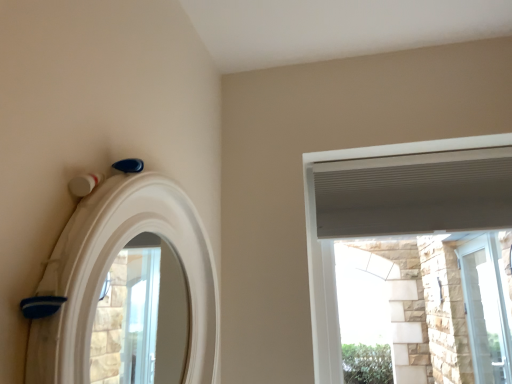
The image size is (512, 384). What do you see at coordinates (109, 268) in the screenshot?
I see `white matte archway at upper left` at bounding box center [109, 268].

The width and height of the screenshot is (512, 384). Identify the location of clear glass door at right, the 1th window in the back-to-front sequence. (486, 310).

The image size is (512, 384). Describe the element at coordinates (395, 209) in the screenshot. I see `white textured window at upper right, arranged as the 2th window when viewed from the back` at that location.

Locate an element on the screen. white matte archway at upper left is located at coordinates (109, 268).

From the image's perspective, between clear glass door at right, the first window when ordered from bottom to top, and white matte archway at upper left, which one is located above?

white matte archway at upper left.

Considering the sizes of objects clear glass door at right, the 1th window in the back-to-front sequence, and white matte archway at upper left in the image provided, who is wider, clear glass door at right, the 1th window in the back-to-front sequence, or white matte archway at upper left?

Wider between the two is white matte archway at upper left.

Considering the relative sizes of clear glass door at right, the second window positioned from the top, and white matte archway at upper left in the image provided, is clear glass door at right, the second window positioned from the top, smaller than white matte archway at upper left?

Correct, clear glass door at right, the second window positioned from the top, occupies less space than white matte archway at upper left.

The image size is (512, 384). In order to click on archway above the clear glass door at right, the 1th window in the back-to-front sequence (from a real-world perspective) in this screenshot , I will do [x=109, y=268].

Does white matte archway at upper left lie behind clear glass door at right, placed as the 2th window when sorted from left to right?

That is False.

Could you tell me if white matte archway at upper left is facing clear glass door at right, acting as the second window starting from the front?

No, white matte archway at upper left is not oriented towards clear glass door at right, acting as the second window starting from the front.

In the scene shown: From a real-world perspective, between white matte archway at upper left and clear glass door at right, the 1th window in the back-to-front sequence, who is vertically higher?

white matte archway at upper left is physically above.

Would you say white matte archway at upper left is outside clear glass door at right, the first window when ordered from bottom to top?

Indeed, white matte archway at upper left is completely outside clear glass door at right, the first window when ordered from bottom to top.

In terms of width, does white textured window at upper right, marked as the first window in a left-to-right arrangement, look wider or thinner when compared to white matte archway at upper left?

Considering their sizes, white textured window at upper right, marked as the first window in a left-to-right arrangement, looks broader than white matte archway at upper left.

Visually, is white textured window at upper right, marked as the first window in a left-to-right arrangement, positioned to the left or to the right of white matte archway at upper left?

white textured window at upper right, marked as the first window in a left-to-right arrangement, is positioned on white matte archway at upper left's right side.

Looking at this image, from the image's perspective, between white textured window at upper right, arranged as the 2th window when viewed from the back, and white matte archway at upper left, which one is located above?

white matte archway at upper left, from the image's perspective.

Would you consider white textured window at upper right, marked as the first window in a left-to-right arrangement, to be distant from clear glass door at right, the second window positioned from the top?

Indeed, white textured window at upper right, marked as the first window in a left-to-right arrangement, is not near clear glass door at right, the second window positioned from the top.

Does white textured window at upper right, marked as the first window in a left-to-right arrangement, have a greater height compared to clear glass door at right, placed as the 2th window when sorted from left to right?

No, white textured window at upper right, marked as the first window in a left-to-right arrangement, is not taller than clear glass door at right, placed as the 2th window when sorted from left to right.

From the image's perspective, which is below, white textured window at upper right, the 1th window positioned from the front, or clear glass door at right, the first window from the right?

clear glass door at right, the first window from the right, appears lower in the image.

How many degrees apart are the facing directions of clear glass door at right, the second window positioned from the top, and white textured window at upper right, which appears as the 2th window when viewed from the right?

0.354 degrees.

In terms of width, does clear glass door at right, the second window positioned from the top, look wider or thinner when compared to white textured window at upper right, marked as the 1th window in a top-to-bottom arrangement?

clear glass door at right, the second window positioned from the top, is thinner than white textured window at upper right, marked as the 1th window in a top-to-bottom arrangement.

From a real-world perspective, which object stands above the other?

From a 3D spatial view, white textured window at upper right, acting as the second window starting from the bottom, is above.

Considering the relative positions of clear glass door at right, the first window from the right, and white textured window at upper right, marked as the first window in a left-to-right arrangement, in the image provided, is clear glass door at right, the first window from the right, to the right of white textured window at upper right, marked as the first window in a left-to-right arrangement, from the viewer's perspective?

Correct, you'll find clear glass door at right, the first window from the right, to the right of white textured window at upper right, marked as the first window in a left-to-right arrangement.

Is white matte archway at upper left bigger or smaller than white textured window at upper right, arranged as the 2th window when viewed from the back?

In the image, white matte archway at upper left appears to be smaller than white textured window at upper right, arranged as the 2th window when viewed from the back.

Is white matte archway at upper left oriented away from white textured window at upper right, which appears as the 2th window when viewed from the right?

No, white matte archway at upper left's orientation is not away from white textured window at upper right, which appears as the 2th window when viewed from the right.

From the image's perspective, who appears lower, white matte archway at upper left or white textured window at upper right, acting as the second window starting from the bottom?

white textured window at upper right, acting as the second window starting from the bottom, appears lower in the image.

Which is closer to the camera, (66,312) or (487,153)?

Point (66,312) is closer to the camera than point (487,153).

Where is `the 2nd window behind the white matte archway at upper left, starting your count from the anchor`? the 2nd window behind the white matte archway at upper left, starting your count from the anchor is located at coordinates (486, 310).

Where is `archway above the clear glass door at right, the first window when ordered from bottom to top (from the image's perspective)`? The height and width of the screenshot is (384, 512). archway above the clear glass door at right, the first window when ordered from bottom to top (from the image's perspective) is located at coordinates (109, 268).

Based on their spatial positions, is white textured window at upper right, acting as the second window starting from the bottom, or white matte archway at upper left further from clear glass door at right, the first window when ordered from bottom to top?

white matte archway at upper left lies further to clear glass door at right, the first window when ordered from bottom to top, than the other object.

From the image, which object appears to be nearer to white matte archway at upper left, clear glass door at right, the 1th window in the back-to-front sequence, or white textured window at upper right, which appears as the 2th window when viewed from the right?

Based on the image, white textured window at upper right, which appears as the 2th window when viewed from the right, appears to be nearer to white matte archway at upper left.

Considering their positions, is white matte archway at upper left positioned closer to clear glass door at right, the second window positioned from the top, than white textured window at upper right, acting as the second window starting from the bottom?

white textured window at upper right, acting as the second window starting from the bottom, is positioned closer to the anchor clear glass door at right, the second window positioned from the top.

Which object lies further to the anchor point white textured window at upper right, the 1th window positioned from the front, clear glass door at right, the 1th window in the back-to-front sequence, or white matte archway at upper left?

Among the two, clear glass door at right, the 1th window in the back-to-front sequence, is located further to white textured window at upper right, the 1th window positioned from the front.

When comparing their distances from white textured window at upper right, marked as the 1th window in a top-to-bottom arrangement, does white matte archway at upper left or clear glass door at right, the first window when ordered from bottom to top, seem further?

clear glass door at right, the first window when ordered from bottom to top.

Looking at this image, considering their positions, is white textured window at upper right, acting as the second window starting from the bottom, positioned closer to white matte archway at upper left than clear glass door at right, the first window from the right?

The object closer to white matte archway at upper left is white textured window at upper right, acting as the second window starting from the bottom.

Where is `window between white matte archway at upper left and clear glass door at right, the second window positioned from the top, in the front-back direction`? window between white matte archway at upper left and clear glass door at right, the second window positioned from the top, in the front-back direction is located at coordinates (395, 209).